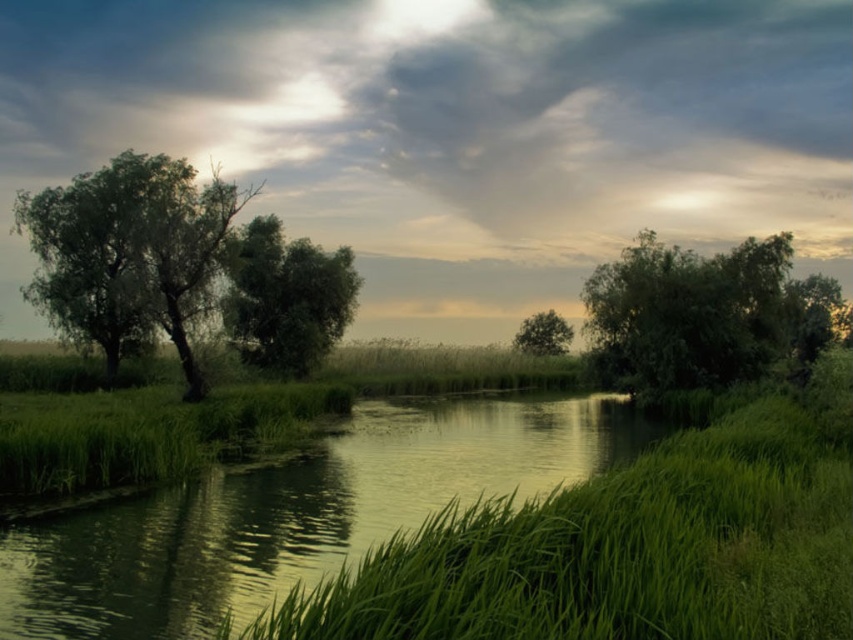
Does green grass at center have a lesser height compared to green leafy tree at left?

Indeed, green grass at center has a lesser height compared to green leafy tree at left.

Is green grass at center positioned before green leafy tree at left?

That is True.

Between point (769, 419) and point (171, 161), which one is positioned in front?

Point (769, 419)

Find the location of a particular element. The height and width of the screenshot is (640, 853). green grass at center is located at coordinates [x=621, y=550].

Does green leafy tree at left have a greater height compared to green leafy tree at center?

Yes, green leafy tree at left is taller than green leafy tree at center.

Is green leafy tree at left closer to the viewer compared to green leafy tree at center?

Yes, it is.

The height and width of the screenshot is (640, 853). What do you see at coordinates (129, 252) in the screenshot? I see `green leafy tree at left` at bounding box center [129, 252].

Find the location of a particular element. This screenshot has width=853, height=640. green leafy tree at left is located at coordinates (129, 252).

Does green grass at center have a lesser width compared to green matte tree at center?

Incorrect, green grass at center's width is not less than green matte tree at center's.

Can you confirm if green grass at center is positioned below green matte tree at center?

Indeed, green grass at center is positioned under green matte tree at center.

Identify the location of green grass at center. (621, 550).